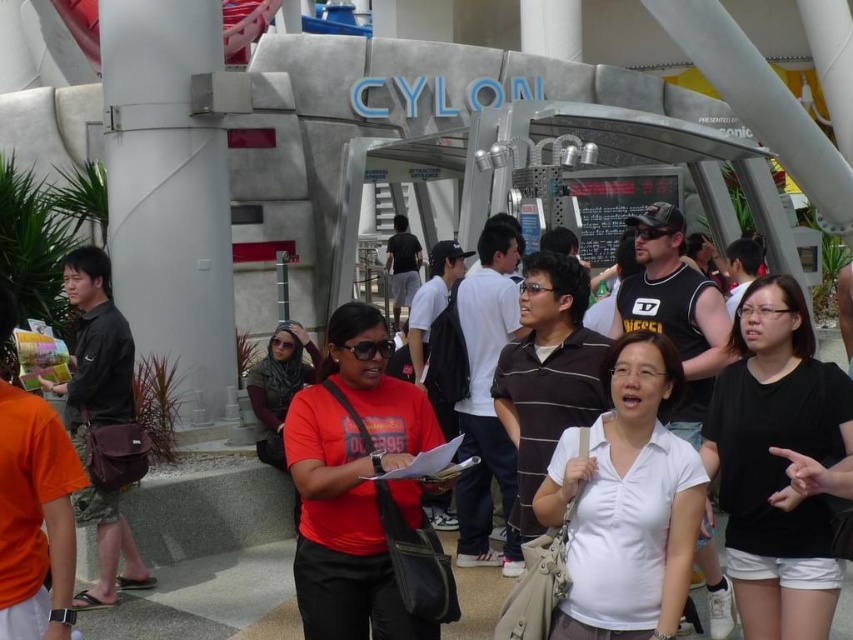
You are a photographer trying to capture both the black cotton shirt at center and the white matte shirt at center in the same frame. Which shirt should you focus on first to ensure both are in the frame?

The black cotton shirt at center is larger in size than the white matte shirt at center, so focus on the larger black cotton shirt first to ensure both fit within the frame.

You are a photographer at the Cylon themed event and need to capture both the black cotton shirt at center and the brown striped polo shirt at center in a single shot. Based on their positions, which one is lower in the frame?

The black cotton shirt at center is below the brown striped polo shirt at center, so it is lower in the frame.

You are a photographer at this themed attraction. You want to take a photo of the white matte shirt at center and the matte black shirt at left without any obstruction. Given their positions, which person should you move forward to ensure both are visible?

The matte black shirt at left is behind the white matte shirt at center, so you should move the matte black shirt at left forward to ensure both are visible without obstruction.